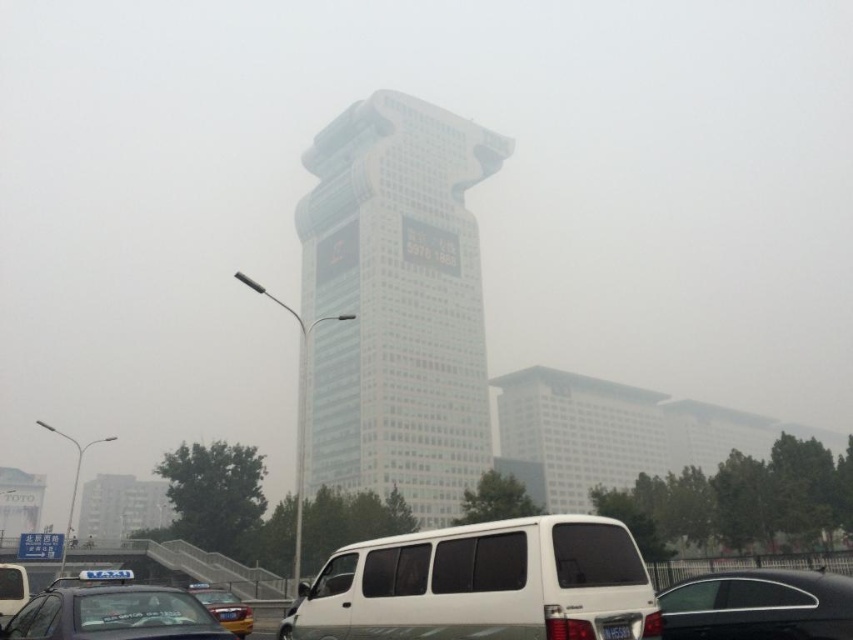
Is white glass building at center shorter than white matte van at center?

Incorrect, white glass building at center's height does not fall short of white matte van at center's.

Is white glass building at center in front of white matte van at center?

No.

This screenshot has height=640, width=853. I want to click on white glass building at center, so (396, 304).

Who is more forward, (97, 608) or (24, 580)?

Point (97, 608) is in front.

Does black plastic taxi cab at lower left have a greater height compared to matte black taxi at lower left?

Yes.

Locate an element on the screen. This screenshot has height=640, width=853. black plastic taxi cab at lower left is located at coordinates (113, 614).

Does yellow metallic car at lower center appear on the left side of matte black taxi at lower left?

No, yellow metallic car at lower center is not to the left of matte black taxi at lower left.

Who is more distant from viewer, (242, 636) or (3, 582)?

Point (242, 636)

At what (x,y) coordinates should I click in order to perform the action: click on yellow metallic car at lower center. Please return your answer as a coordinate pair (x, y). The width and height of the screenshot is (853, 640). Looking at the image, I should click on (224, 608).